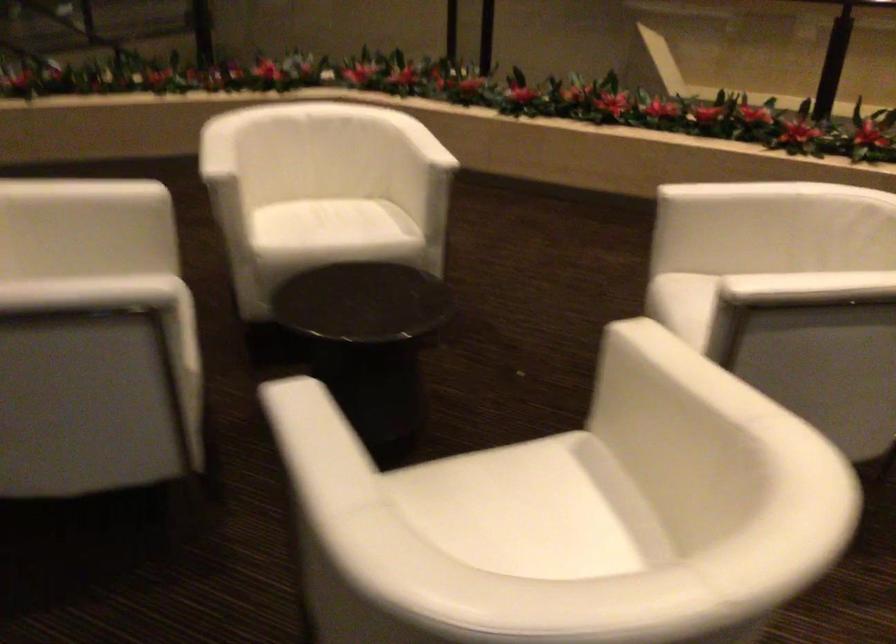
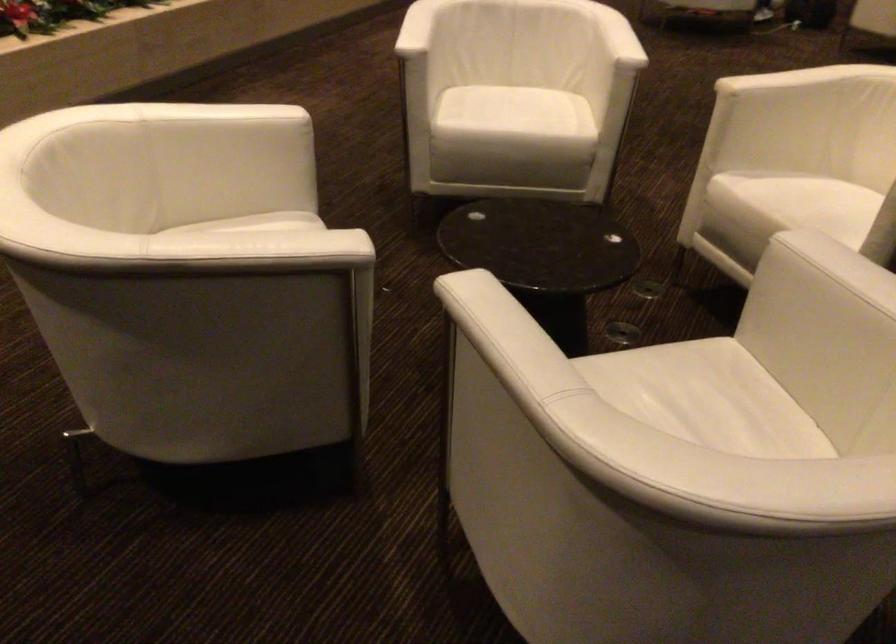
In the second image, find the point that corresponds to the point at 498,474 in the first image.

(794, 198)